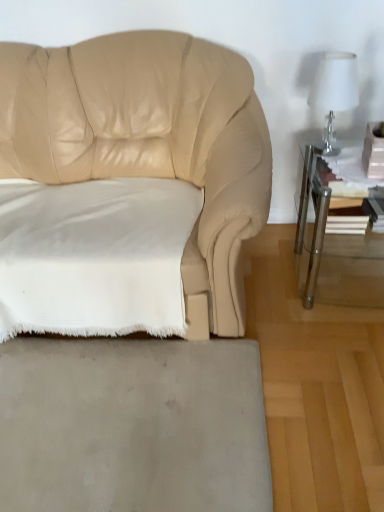
In order to click on vacant space situated on the left part of clear glass table at right in this screenshot , I will do `click(269, 280)`.